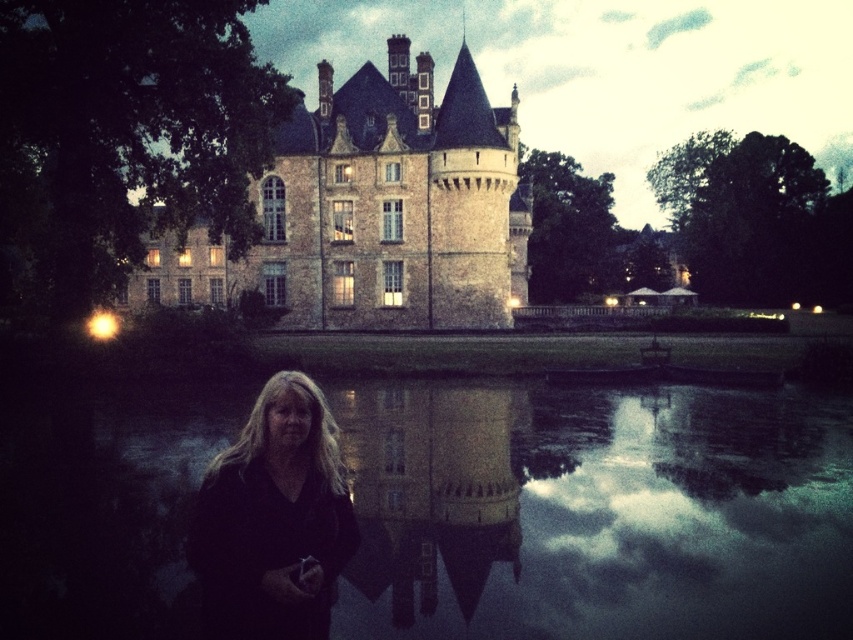
Who is more forward, (354, 205) or (485, 444)?

Point (485, 444) is more forward.

Does point (347, 97) come in front of point (376, 477)?

That is False.

Identify the location of brown stone castle at upper center. The width and height of the screenshot is (853, 640). (372, 211).

Locate an element on the screen. This screenshot has width=853, height=640. brown stone castle at upper center is located at coordinates (372, 211).

Does brown stone castle at upper center appear over black matte hair at center?

Yes, brown stone castle at upper center is above black matte hair at center.

Does brown stone castle at upper center have a greater width compared to black matte hair at center?

Indeed, brown stone castle at upper center has a greater width compared to black matte hair at center.

Measure the distance between brown stone castle at upper center and camera.

brown stone castle at upper center is 94.20 meters from camera.

At what (x,y) coordinates should I click in order to perform the action: click on brown stone castle at upper center. Please return your answer as a coordinate pair (x, y). The image size is (853, 640). Looking at the image, I should click on (372, 211).

Does smooth reflective water at center appear on the right side of brown stone castle at upper center?

Correct, you'll find smooth reflective water at center to the right of brown stone castle at upper center.

Between smooth reflective water at center and brown stone castle at upper center, which one has less height?

Standing shorter between the two is smooth reflective water at center.

This screenshot has width=853, height=640. What are the coordinates of `smooth reflective water at center` in the screenshot? It's located at (596, 513).

Find the location of `smooth reflective water at center`. smooth reflective water at center is located at coordinates (596, 513).